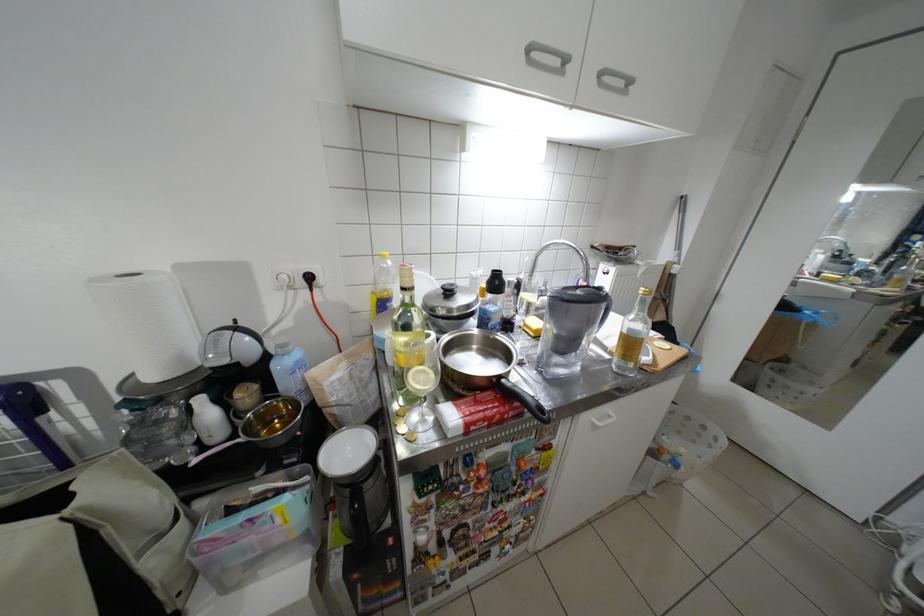
This screenshot has height=616, width=924. I want to click on small metal saucepan, so click(x=483, y=367).